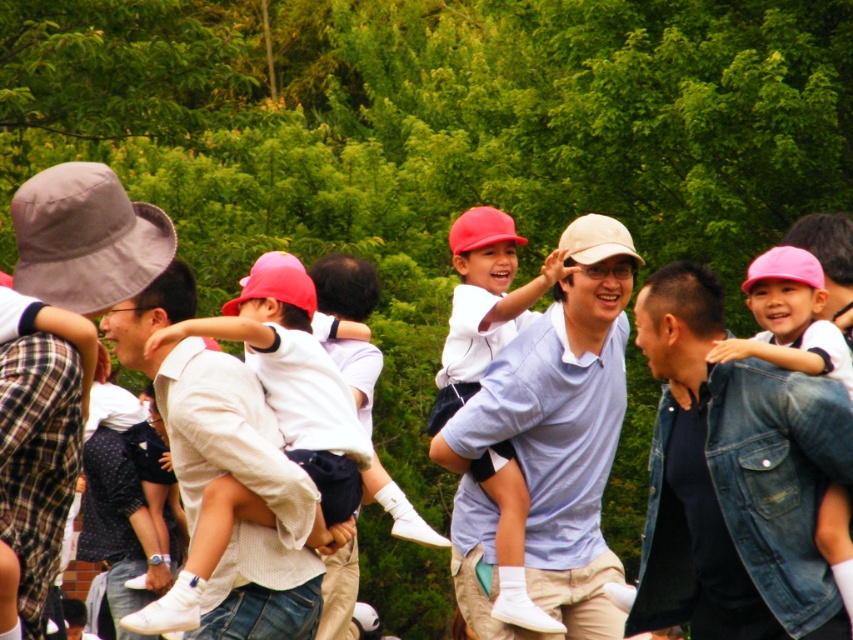
Between gray fabric baseball hat at left and pink denim jacket at center, which one is positioned higher?

gray fabric baseball hat at left is higher up.

Is point (91, 192) positioned before point (735, 348)?

Yes, point (91, 192) is in front of point (735, 348).

Does point (119, 273) come behind point (787, 246)?

No, (119, 273) is in front of (787, 246).

The height and width of the screenshot is (640, 853). What are the coordinates of `gray fabric baseball hat at left` in the screenshot? It's located at (85, 237).

Which of these two, matte white shirt at center or pink denim jacket at center, stands taller?

matte white shirt at center

Is matte white shirt at center below pink denim jacket at center?

Actually, matte white shirt at center is above pink denim jacket at center.

This screenshot has width=853, height=640. What do you see at coordinates (483, 305) in the screenshot?
I see `matte white shirt at center` at bounding box center [483, 305].

Find the location of a particular element. This screenshot has width=853, height=640. matte white shirt at center is located at coordinates (483, 305).

Does matte white shirt at center appear under gray fabric baseball hat at left?

Yes, matte white shirt at center is below gray fabric baseball hat at left.

This screenshot has width=853, height=640. What are the coordinates of `matte white shirt at center` in the screenshot? It's located at (483, 305).

Between point (457, 307) and point (62, 298), which one is positioned behind?

Positioned behind is point (457, 307).

The width and height of the screenshot is (853, 640). I want to click on matte white shirt at center, so click(483, 305).